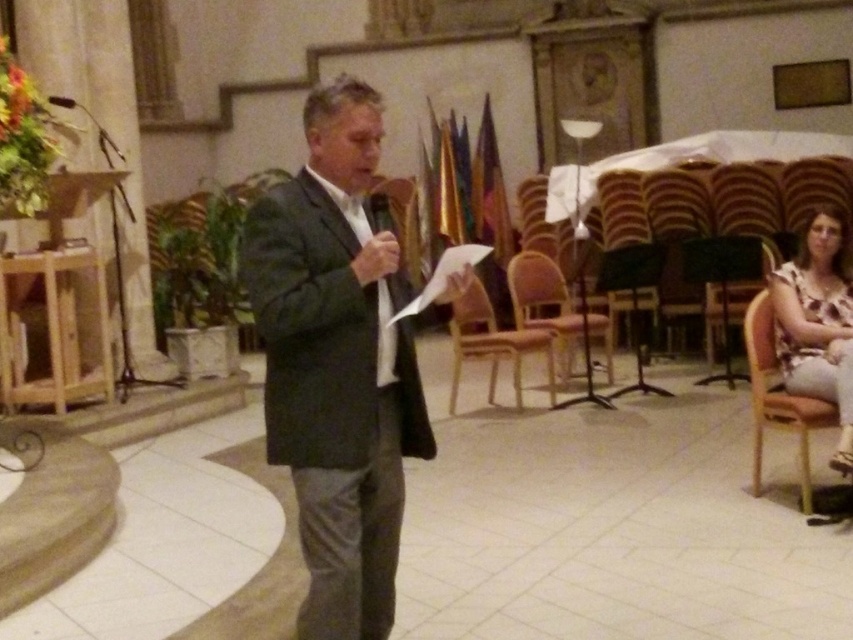
Which is behind, point (412, 435) or point (511, 291)?

Point (511, 291)

Can you confirm if dark gray suit at center is smaller than metallic gold chair at center?

Yes.

Does point (329, 236) lie in front of point (575, 317)?

Yes, point (329, 236) is in front of point (575, 317).

Identify the location of dark gray suit at center. (337, 362).

Is dark gray suit at center in front of wooden chair at center?

That is True.

Can you confirm if dark gray suit at center is shorter than wooden chair at center?

No.

What do you see at coordinates (337, 362) in the screenshot? Image resolution: width=853 pixels, height=640 pixels. I see `dark gray suit at center` at bounding box center [337, 362].

At what (x,y) coordinates should I click in order to perform the action: click on dark gray suit at center. Please return your answer as a coordinate pair (x, y). Looking at the image, I should click on (337, 362).

Is light brown wooden chair at center to the left of wooden chair at center from the viewer's perspective?

Indeed, light brown wooden chair at center is positioned on the left side of wooden chair at center.

Between point (459, 330) and point (759, 248), which one is positioned behind?

Point (459, 330)

What do you see at coordinates (492, 342) in the screenshot?
I see `light brown wooden chair at center` at bounding box center [492, 342].

Image resolution: width=853 pixels, height=640 pixels. In order to click on light brown wooden chair at center in this screenshot , I will do `click(492, 342)`.